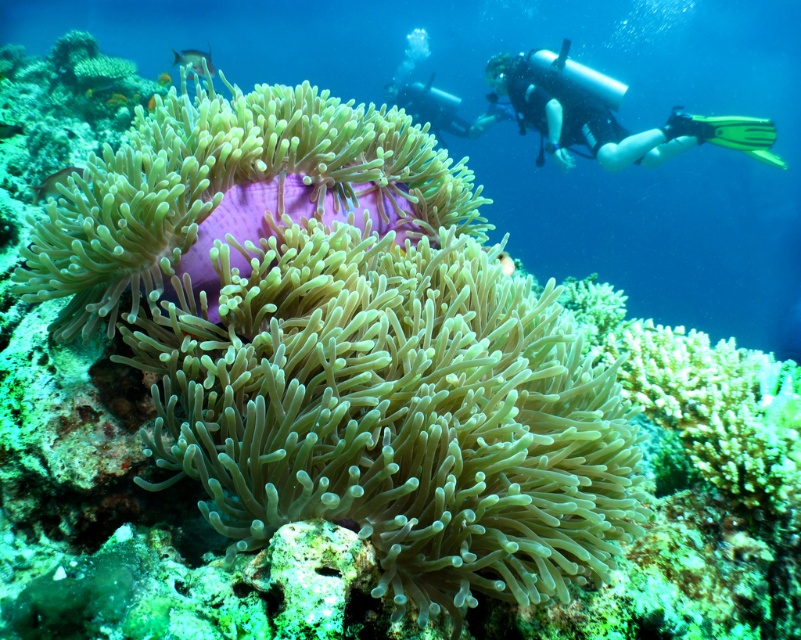
You are a marine biologist observing the underwater scene. You notice the shiny silver fish at lower left and the orange matte fish at center. Which fish has a smaller width?

The shiny silver fish at lower left has a smaller width than the orange matte fish at center.

You are a marine biologist observing underwater life. You notice the translucent green coral at center and the orange matte fish at center. Which one is smaller in size?

The translucent green coral at center has a smaller size compared to the orange matte fish at center.